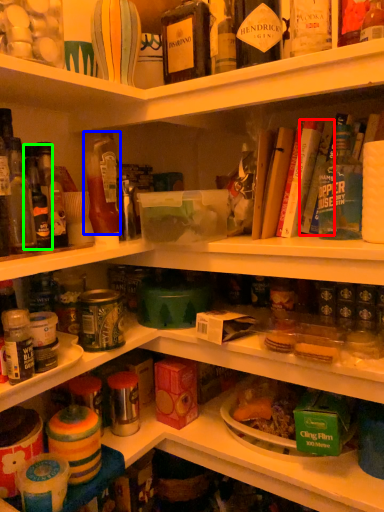
Question: Which is nearer to the book (highlighted by a red box)? bottle (highlighted by a blue box) or bottle (highlighted by a green box).

Choices:
 (A) bottle
 (B) bottle

Answer: (A)